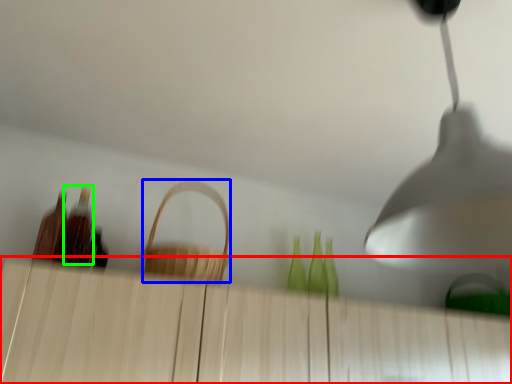
Question: Based on their relative distances, which object is nearer to dresser (highlighted by a red box)? Choose from basket (highlighted by a blue box) and bottle (highlighted by a green box).

Choices:
 (A) basket
 (B) bottle

Answer: (A)